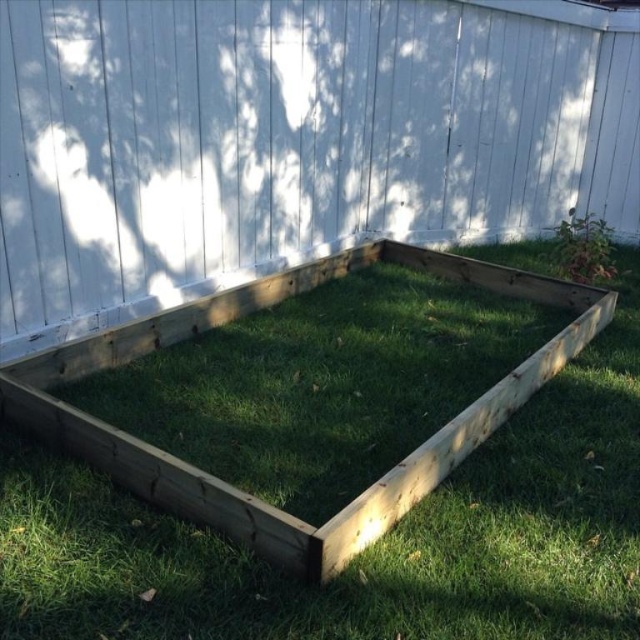
Question: Is the position of natural wood fence at center less distant than that of green grass at center?

Choices:
 (A) yes
 (B) no

Answer: (B)

Question: Observing the image, what is the correct spatial positioning of natural wood fence at center in reference to green grass at center?

Choices:
 (A) above
 (B) below

Answer: (A)

Question: Among these points, which one is farthest from the camera?

Choices:
 (A) pos(557,134)
 (B) pos(227,604)

Answer: (A)

Question: Which point is farther from the camera taking this photo?

Choices:
 (A) (284, 349)
 (B) (276, 52)

Answer: (B)

Question: Among these points, which one is nearest to the camera?

Choices:
 (A) (220, 33)
 (B) (371, 428)

Answer: (B)

Question: Can you confirm if natural wood fence at center is thinner than green grass at center?

Choices:
 (A) no
 (B) yes

Answer: (B)